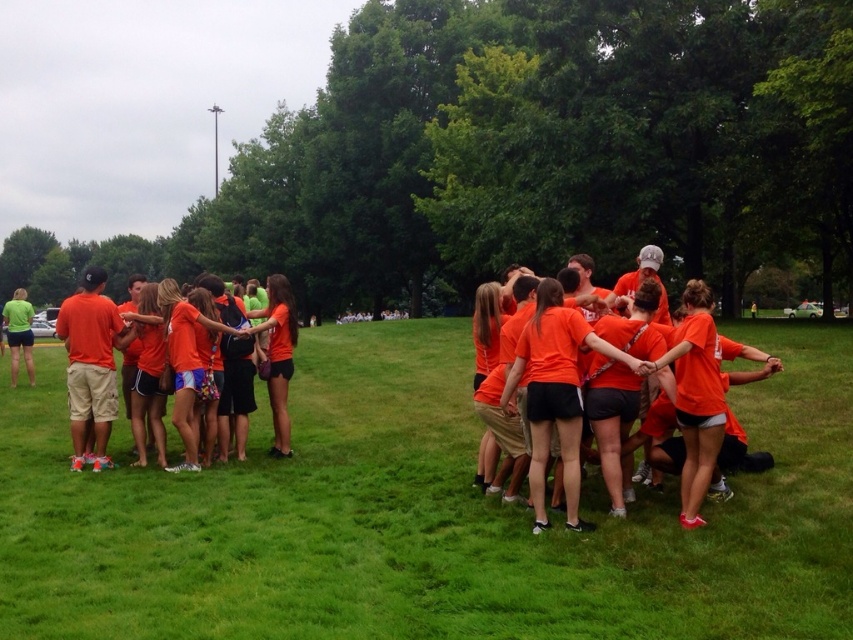
Can you confirm if green grass at center is positioned to the left of orange cotton shirt at center?

In fact, green grass at center is to the right of orange cotton shirt at center.

Does green grass at center have a smaller size compared to orange cotton shirt at center?

No.

Is point (590, 600) positioned before point (169, 307)?

Yes.

At what (x,y) coordinates should I click in order to perform the action: click on green grass at center. Please return your answer as a coordinate pair (x, y). Looking at the image, I should click on (422, 516).

Based on the photo, which is below, orange cotton shirt at center or orange fabric shirt at center?

orange fabric shirt at center is lower down.

Does orange cotton shirt at center have a lesser width compared to orange fabric shirt at center?

Incorrect, orange cotton shirt at center's width is not less than orange fabric shirt at center's.

You are a GUI agent. You are given a task and a screenshot of the screen. Output one action in this format:
    pyautogui.click(x=<x>, y=<y>)
    Task: Click on the orange cotton shirt at center
    
    Given the screenshot: What is the action you would take?
    pyautogui.click(x=187, y=364)

The image size is (853, 640). Identify the location of orange cotton shirt at center. (187, 364).

Which of these two, orange cotton shirt at center or matte green shirt at left, stands taller?

matte green shirt at left

Is orange cotton shirt at center to the left of matte green shirt at left from the viewer's perspective?

No, orange cotton shirt at center is not to the left of matte green shirt at left.

Is point (173, 324) positioned behind point (21, 312)?

No, (173, 324) is closer to viewer.

You are a GUI agent. You are given a task and a screenshot of the screen. Output one action in this format:
    pyautogui.click(x=<x>, y=<y>)
    Task: Click on the orange cotton shirt at center
    
    Given the screenshot: What is the action you would take?
    pyautogui.click(x=187, y=364)